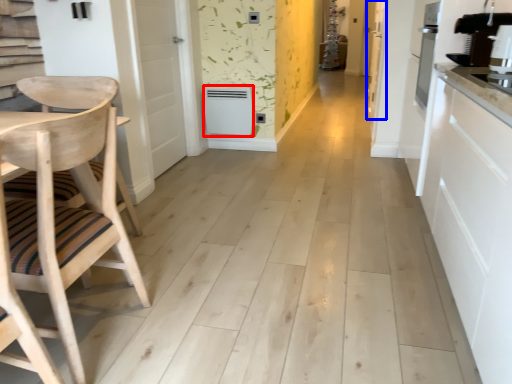
Question: Which of the following is the farthest to the observer, appliance (highlighted by a red box) or door (highlighted by a blue box)?

Choices:
 (A) appliance
 (B) door

Answer: (B)